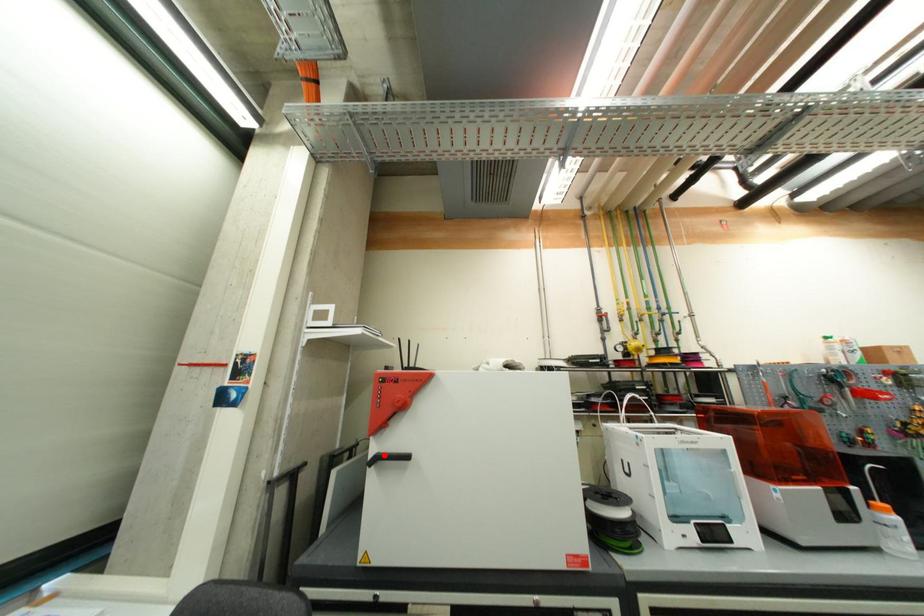
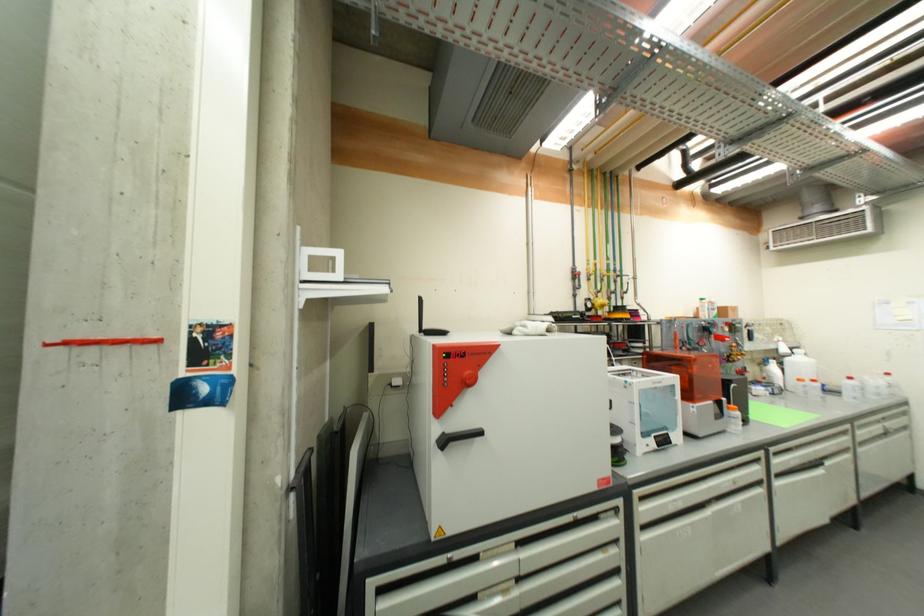
Where in the second image is the point corresponding to the highlighted location from the first image?

(448, 435)